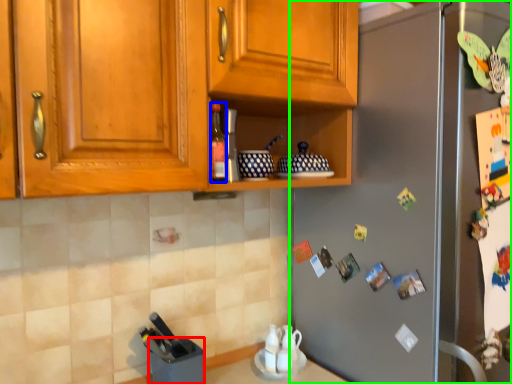
Question: Estimate the real-world distances between objects in this image. Which object is closer to appliance (highlighted by a red box), bottle (highlighted by a blue box) or refrigerator (highlighted by a green box)?

Choices:
 (A) bottle
 (B) refrigerator

Answer: (A)